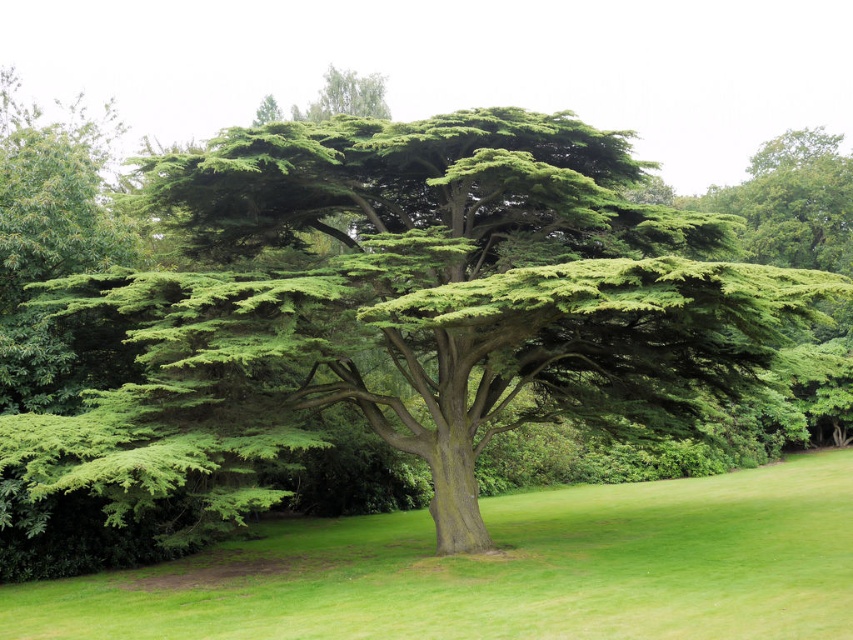
Question: Does green textured tree at center come in front of green grass at center?

Choices:
 (A) no
 (B) yes

Answer: (A)

Question: Is green textured tree at center behind green grass at center?

Choices:
 (A) no
 (B) yes

Answer: (B)

Question: Which point is farther to the camera?

Choices:
 (A) green grass at center
 (B) green textured tree at center

Answer: (B)

Question: Can you confirm if green textured tree at center is positioned to the left of green grass at center?

Choices:
 (A) no
 (B) yes

Answer: (B)

Question: Among these objects, which one is farthest from the camera?

Choices:
 (A) green textured tree at center
 (B) green grass at center

Answer: (A)